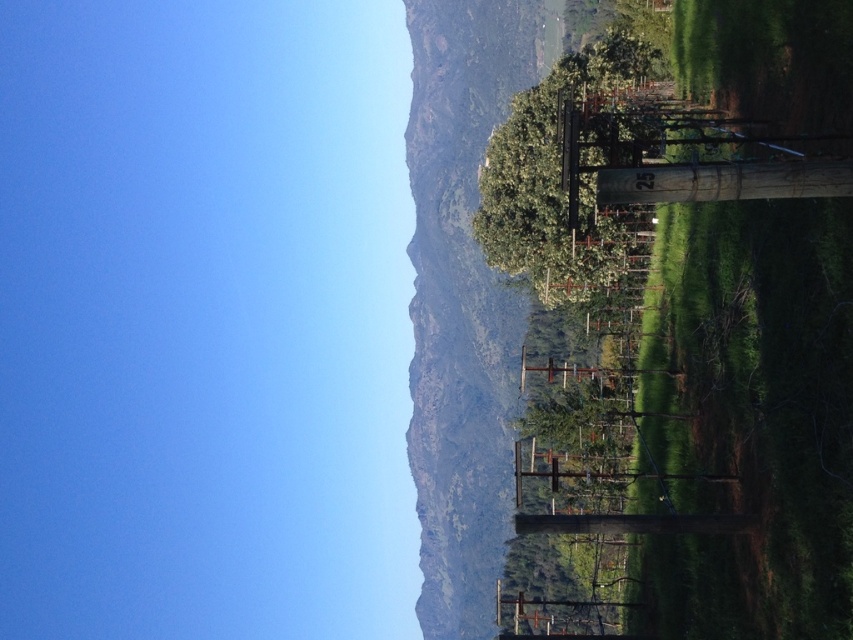
Question: Which of the following is the closest to the observer?

Choices:
 (A) green leafy hillside at upper center
 (B) green grassy hillside at right
 (C) green leafy tree at center

Answer: (B)

Question: Which is farther from the green leafy hillside at upper center?

Choices:
 (A) green leafy tree at center
 (B) green grassy hillside at right

Answer: (A)

Question: Can you confirm if green leafy hillside at upper center is smaller than green leafy tree at center?

Choices:
 (A) yes
 (B) no

Answer: (B)

Question: Does green leafy hillside at upper center appear over green leafy tree at center?

Choices:
 (A) no
 (B) yes

Answer: (B)

Question: Considering the real-world distances, which object is closest to the green leafy tree at center?

Choices:
 (A) green grassy hillside at right
 (B) green leafy hillside at upper center

Answer: (A)

Question: Is green grassy hillside at right closer to camera compared to green leafy tree at center?

Choices:
 (A) no
 (B) yes

Answer: (B)